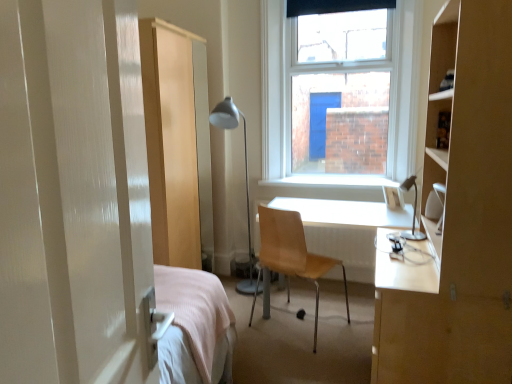
At what (x,y) coordinates should I click in order to perform the action: click on free spot below wooden chair at center (from a real-world perspective). Please return your answer as a coordinate pair (x, y). The image size is (512, 384). Looking at the image, I should click on (287, 333).